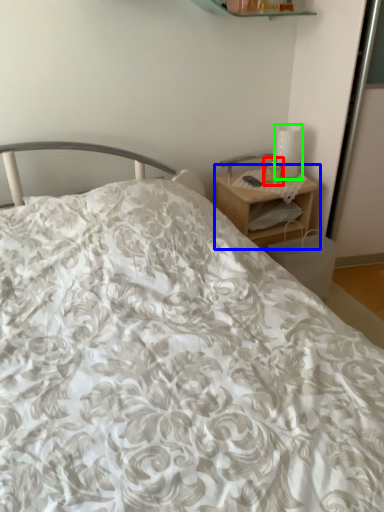
Question: Based on their relative distances, which object is nearer to candle holder (highlighted by a red box)? Choose from nightstand (highlighted by a blue box) and table lamp (highlighted by a green box).

Choices:
 (A) nightstand
 (B) table lamp

Answer: (B)